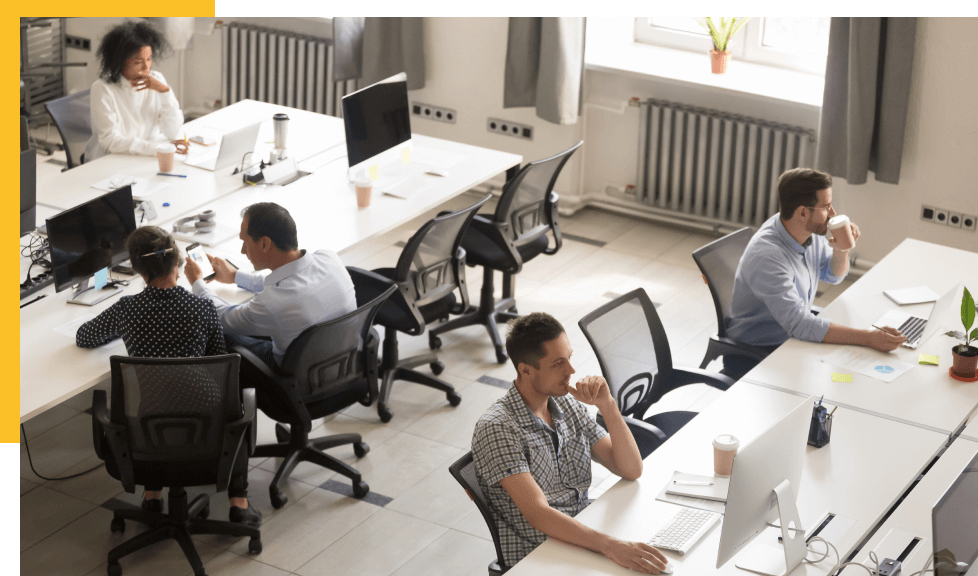
Locate an element on the screen. chair is located at coordinates (178, 411), (326, 358), (421, 272), (502, 233), (68, 115), (626, 363), (458, 467), (722, 260).